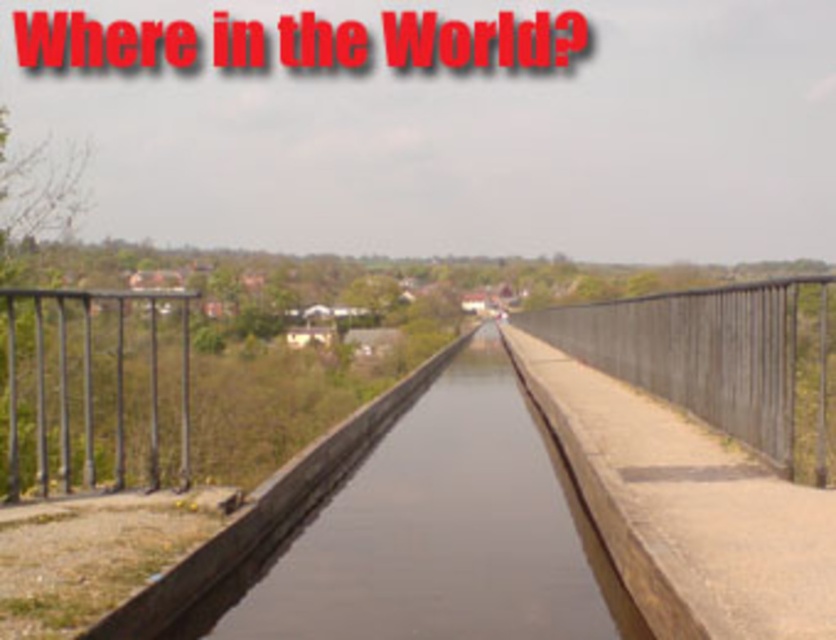
Question: Which point is closer to the camera?

Choices:
 (A) black metal railing at left
 (B) metallic gray rail at right

Answer: (A)

Question: Among these points, which one is nearest to the camera?

Choices:
 (A) (809, 336)
 (B) (18, 380)

Answer: (B)

Question: Does metallic gray rail at right have a larger size compared to black metal railing at left?

Choices:
 (A) no
 (B) yes

Answer: (B)

Question: Can you confirm if metallic gray rail at right is positioned below black metal railing at left?

Choices:
 (A) yes
 (B) no

Answer: (B)

Question: Is metallic gray rail at right thinner than black metal railing at left?

Choices:
 (A) no
 (B) yes

Answer: (B)